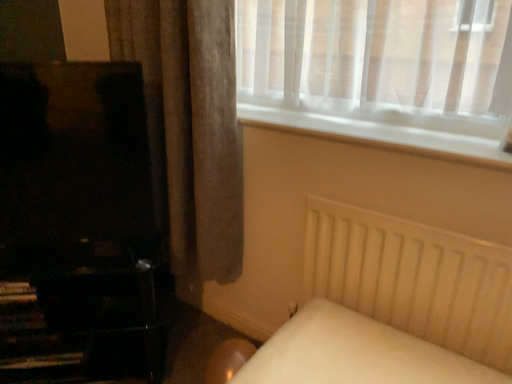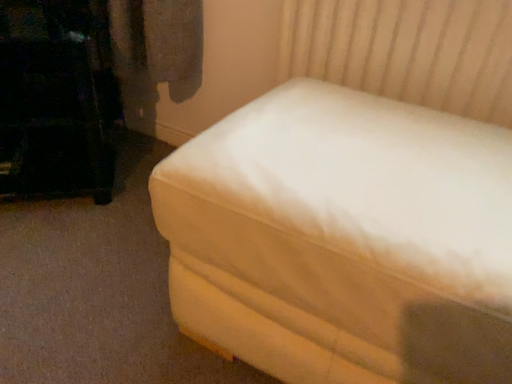
Question: How did the camera likely rotate when shooting the video?

Choices:
 (A) rotated downward
 (B) rotated upward

Answer: (A)